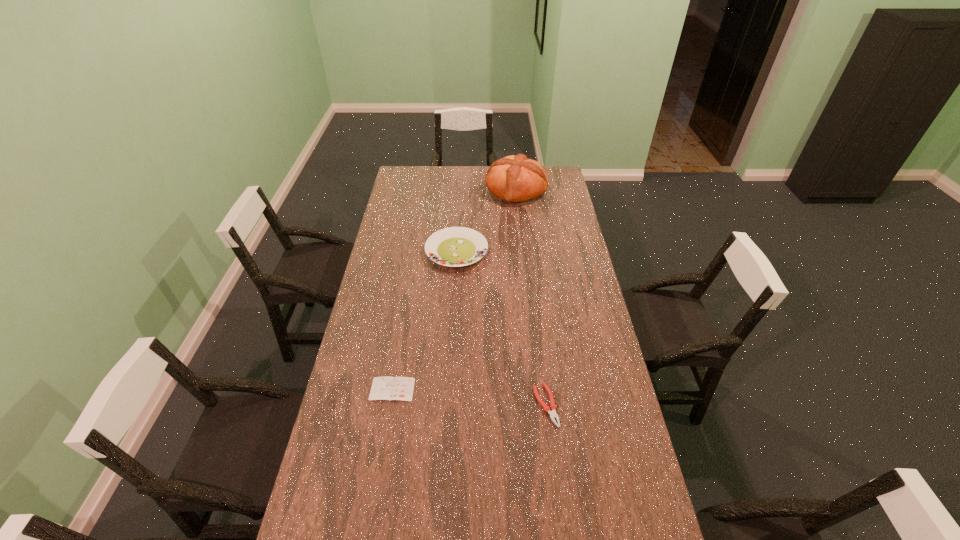
Locate an element on the screen. The image size is (960, 540). object that is at the far edge is located at coordinates (514, 178).

Where is `object that is positioned at the left edge`? object that is positioned at the left edge is located at coordinates (389, 388).

This screenshot has width=960, height=540. Identify the location of object that is at the right edge. (514, 178).

Where is `object located in the far right corner section of the desktop`? This screenshot has width=960, height=540. object located in the far right corner section of the desktop is located at coordinates point(514,178).

Locate an element on the screen. The image size is (960, 540). vacant space at the far edge is located at coordinates (473, 181).

At what (x,y) coordinates should I click in order to perform the action: click on free spot at the left edge of the desktop. Please return your answer as a coordinate pair (x, y). This screenshot has width=960, height=540. Looking at the image, I should click on (365, 300).

This screenshot has height=540, width=960. I want to click on free space at the right edge, so click(x=577, y=267).

The width and height of the screenshot is (960, 540). I want to click on unoccupied area between the shortest object and the tallest object, so click(x=454, y=289).

The height and width of the screenshot is (540, 960). I want to click on empty space between the second farthest object and the farthest object, so click(x=486, y=220).

In order to click on free space between the pliers and the second tallest object in this screenshot , I will do `click(501, 328)`.